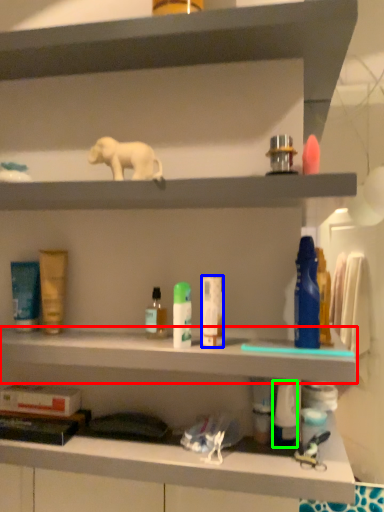
Question: Estimate the real-world distances between objects in this image. Which object is closer to cabinet (highlighted by a red box), toiletry (highlighted by a blue box) or toiletry (highlighted by a green box)?

Choices:
 (A) toiletry
 (B) toiletry

Answer: (A)